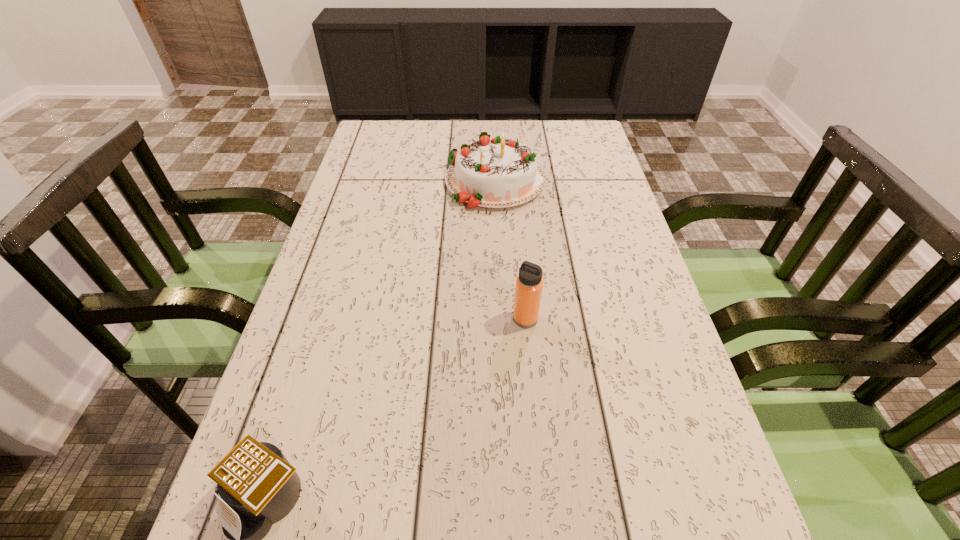
I want to click on cake, so click(497, 173).

At what (x,y) coordinates should I click in order to perform the action: click on the second nearest object. Please return your answer as a coordinate pair (x, y). This screenshot has width=960, height=540. Looking at the image, I should click on (529, 284).

Find the location of a particular element. vacant space located on the front of the farthest object is located at coordinates (496, 226).

The height and width of the screenshot is (540, 960). I want to click on free point located 0.130m on the back of the second nearest object, so click(x=521, y=268).

I want to click on object located at the far edge, so click(497, 173).

In the image, there is a desktop. Where is `vacant space at the far edge`? This screenshot has width=960, height=540. vacant space at the far edge is located at coordinates (452, 142).

This screenshot has width=960, height=540. What are the coordinates of `vacant space at the left edge of the desktop` in the screenshot? It's located at (363, 309).

This screenshot has height=540, width=960. In order to click on vacant space at the right edge of the desktop in this screenshot , I will do `click(597, 246)`.

Image resolution: width=960 pixels, height=540 pixels. I want to click on vacant area at the far left corner of the desktop, so click(x=405, y=131).

The height and width of the screenshot is (540, 960). What are the coordinates of `vacant space at the far right corner` in the screenshot? It's located at (584, 130).